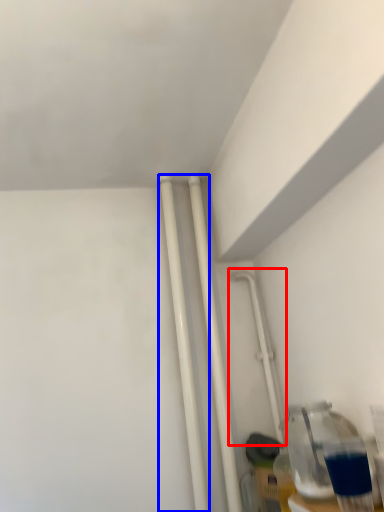
Question: Which object appears closest to the camera in this image, water pipe (highlighted by a red box) or pipe (highlighted by a blue box)?

Choices:
 (A) water pipe
 (B) pipe

Answer: (B)